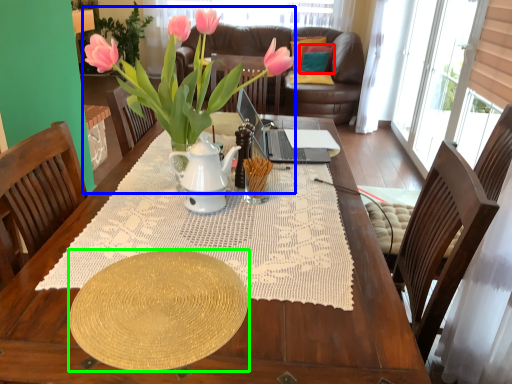
Question: Which object is positioned closest to pillow (highlighted by a red box)? Select from houseplant (highlighted by a blue box) and plate (highlighted by a green box).

Choices:
 (A) houseplant
 (B) plate

Answer: (A)